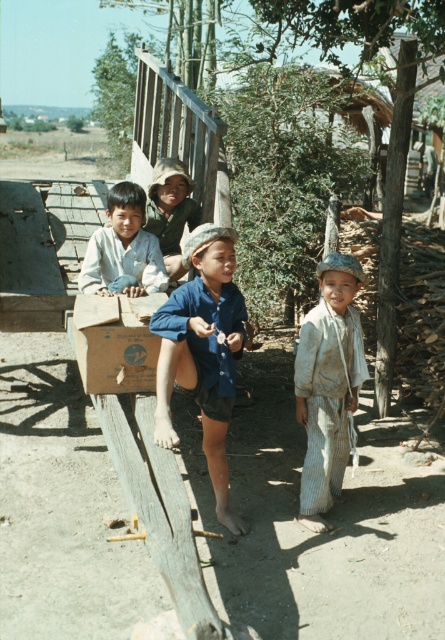
Describe the element at coordinates (116, 342) in the screenshot. The width and height of the screenshot is (445, 640). I see `brown cardboard box at center` at that location.

Does brown cardboard box at center come behind light brown fabric hat at center?

No, it is not.

Find the location of a particular element. The image size is (445, 640). brown cardboard box at center is located at coordinates (116, 342).

Is blue cotton shirt at center to the right of light brown striped pants at center from the viewer's perspective?

No, blue cotton shirt at center is not to the right of light brown striped pants at center.

Which is more to the left, blue cotton shirt at center or light brown striped pants at center?

blue cotton shirt at center is more to the left.

Is point (174, 435) farther from viewer compared to point (300, 508)?

That is False.

Locate an element on the screen. blue cotton shirt at center is located at coordinates (202, 353).

Does brown cardboard box at center come behind matte blue shirt at center?

No, brown cardboard box at center is in front of matte blue shirt at center.

In the scene shown: Is brown cardboard box at center to the left of matte blue shirt at center from the viewer's perspective?

Incorrect, brown cardboard box at center is not on the left side of matte blue shirt at center.

Is point (85, 371) positioned behind point (113, 202)?

No, (85, 371) is in front of (113, 202).

Where is `brown cardboard box at center`? This screenshot has height=640, width=445. brown cardboard box at center is located at coordinates (116, 342).